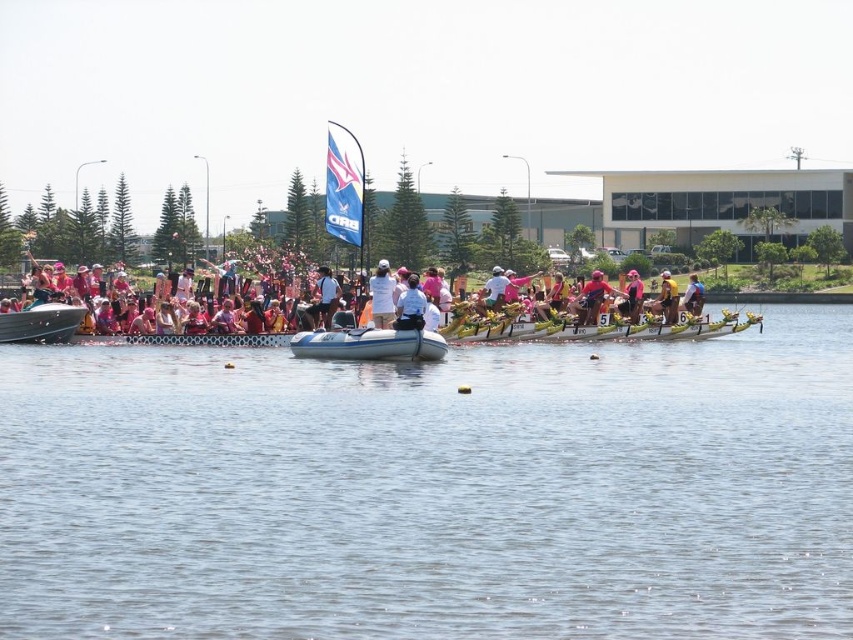
Looking at this image, can you confirm if pink fabric person at center is positioned below yellow fabric shirt at center?

Incorrect, pink fabric person at center is not positioned below yellow fabric shirt at center.

Based on the photo, can you confirm if pink fabric person at center is positioned above yellow fabric shirt at center?

Yes.

Does point (599, 280) come farther from viewer compared to point (671, 291)?

No.

The height and width of the screenshot is (640, 853). I want to click on pink fabric person at center, so click(590, 298).

Measure the distance between white cloth at center and pink fabric person at center.

A distance of 15.37 meters exists between white cloth at center and pink fabric person at center.

Is white cloth at center below pink fabric person at center?

No, white cloth at center is not below pink fabric person at center.

Does point (378, 314) lie in front of point (604, 291)?

Yes, point (378, 314) is in front of point (604, 291).

Locate an element on the screen. This screenshot has width=853, height=640. white cloth at center is located at coordinates (381, 296).

In the scene shown: Who is higher up, clear water at center or white cotton shirt at center?

white cotton shirt at center is higher up.

Locate an element on the screen. This screenshot has width=853, height=640. clear water at center is located at coordinates (433, 490).